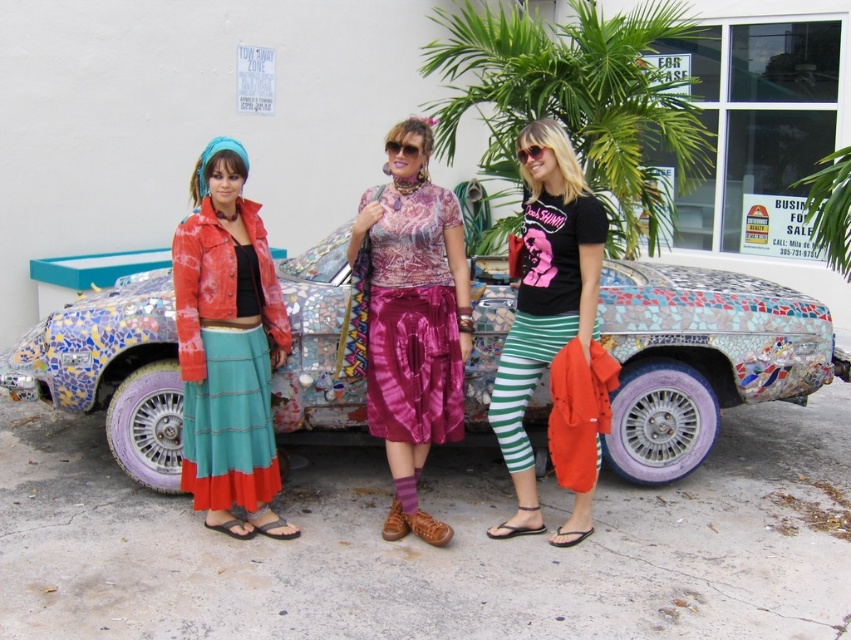
Question: Can you confirm if shiny silk blouse at center is positioned to the left of green striped leggings at center?

Choices:
 (A) no
 (B) yes

Answer: (B)

Question: Is multicolored mosaic car at center to the left of shiny silk blouse at center from the viewer's perspective?

Choices:
 (A) yes
 (B) no

Answer: (B)

Question: Which point is closer to the camera?

Choices:
 (A) matte red jacket at center
 (B) multicolored mosaic car at center

Answer: (A)

Question: Can you confirm if multicolored mosaic car at center is smaller than green striped leggings at center?

Choices:
 (A) yes
 (B) no

Answer: (B)

Question: Among these objects, which one is nearest to the camera?

Choices:
 (A) shiny silk blouse at center
 (B) matte red jacket at center

Answer: (B)

Question: Which object appears closest to the camera in this image?

Choices:
 (A) green striped leggings at center
 (B) shiny silk blouse at center
 (C) multicolored mosaic car at center

Answer: (A)